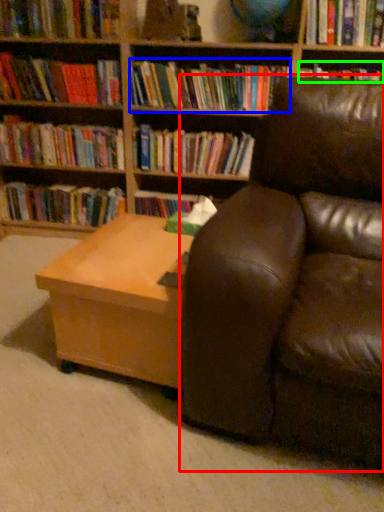
Question: Which object is the closest to the studio couch (highlighted by a red box)? Choose among these: book (highlighted by a blue box) or book (highlighted by a green box).

Choices:
 (A) book
 (B) book

Answer: (B)